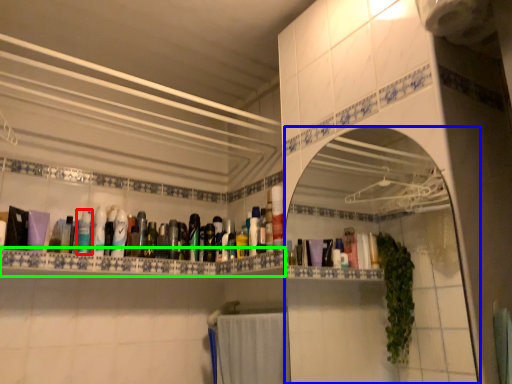
Question: Considering the real-world distances, which object is farthest from mouthwash (highlighted by a red box)? mirror (highlighted by a blue box) or ledge (highlighted by a green box)?

Choices:
 (A) mirror
 (B) ledge

Answer: (A)